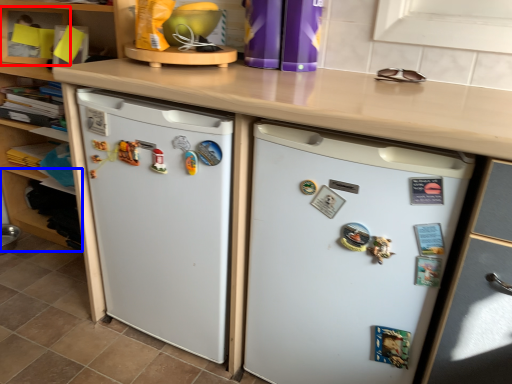
Question: Which object is closer to the camera taking this photo, shelf (highlighted by a red box) or shelf (highlighted by a blue box)?

Choices:
 (A) shelf
 (B) shelf

Answer: (B)